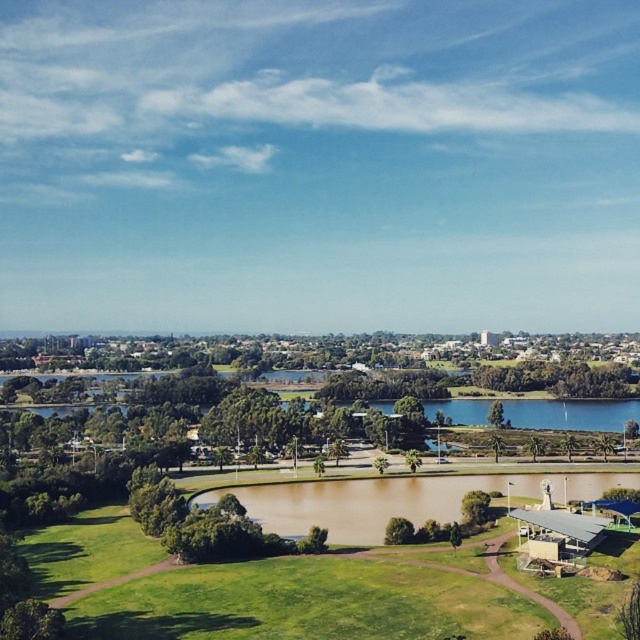
Question: Does green grassy golf course at lower left have a greater width compared to brown matte water at center?

Choices:
 (A) no
 (B) yes

Answer: (B)

Question: Does green grassy golf course at lower left come behind brown matte water at center?

Choices:
 (A) no
 (B) yes

Answer: (A)

Question: Is green grassy golf course at lower left behind brown matte water at center?

Choices:
 (A) yes
 (B) no

Answer: (B)